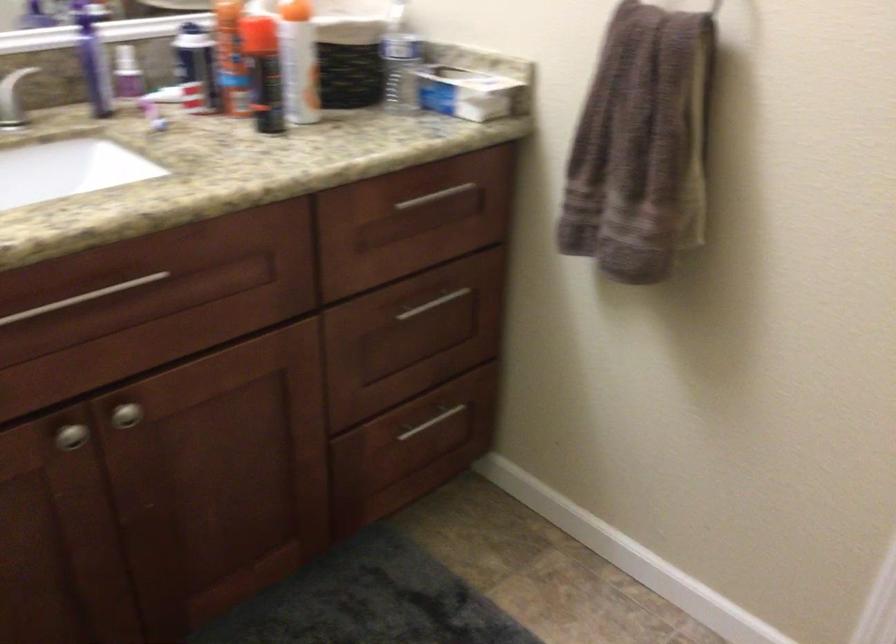
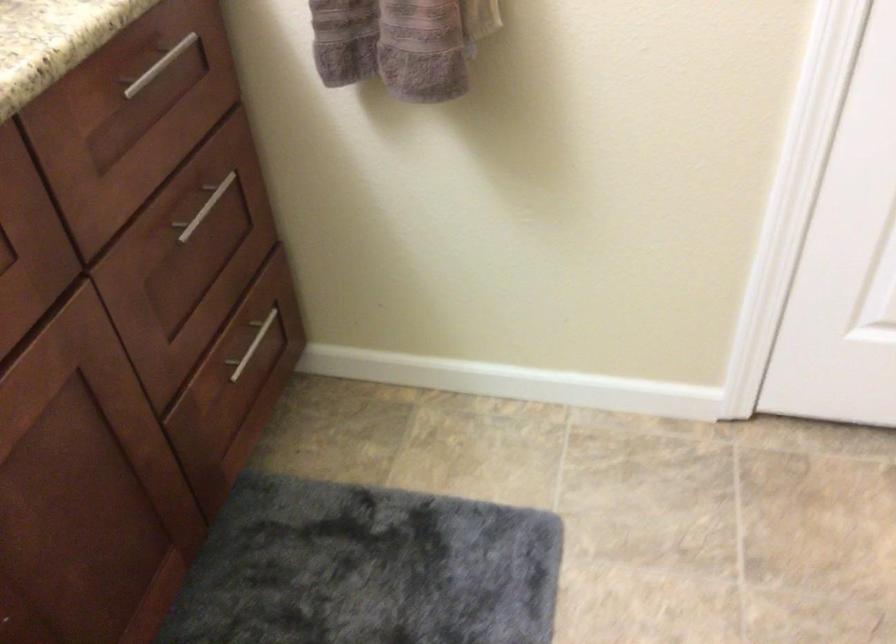
Where in the second image is the point corresponding to point (426, 421) from the first image?

(252, 345)